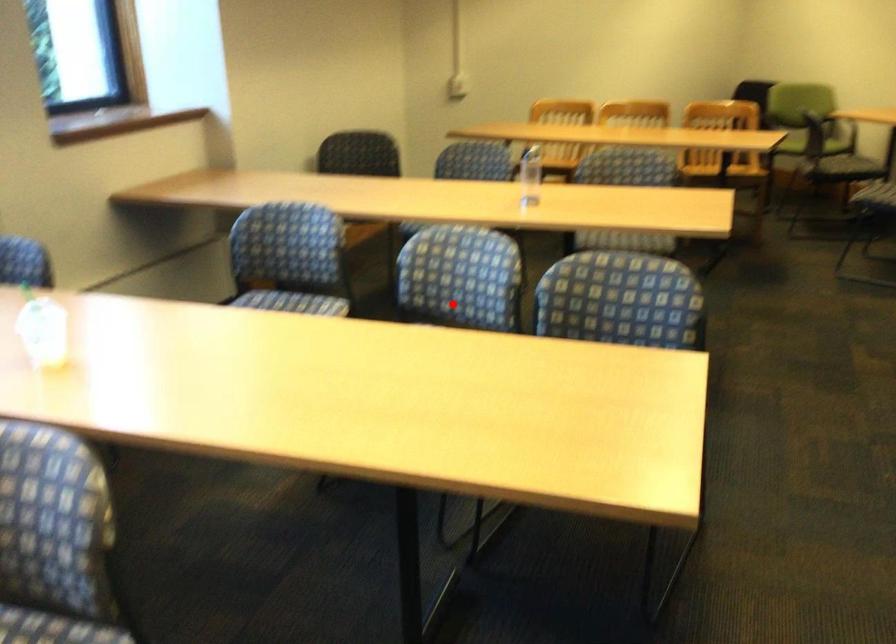
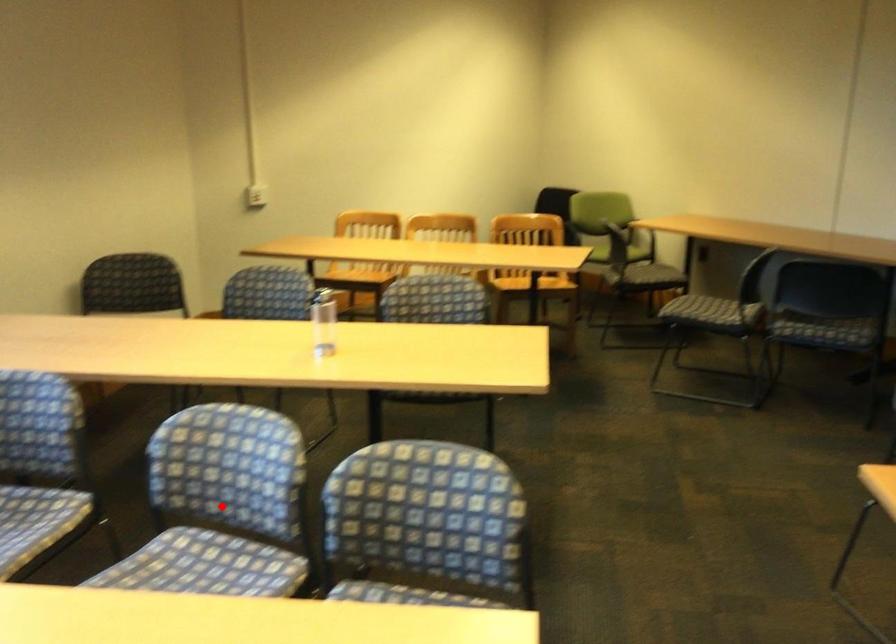
I am providing you with two images of the same scene from different viewpoints. A red point is marked on the first image and another point is marked on the second image. Do the highlighted points in image1 and image2 indicate the same real-world spot?

Yes